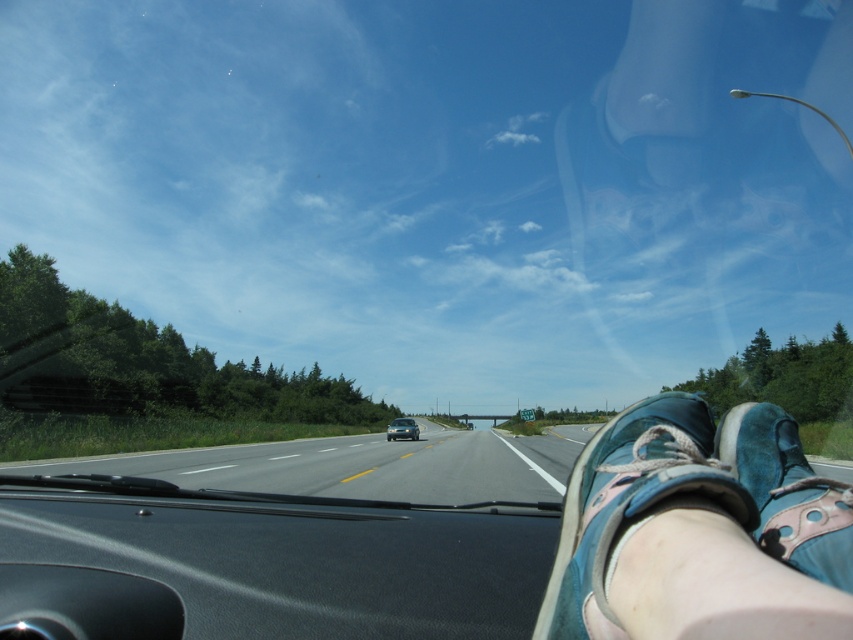
In the scene shown: Who is higher up, suede blue shoe at lower right or metallic silver sedan at center?

Positioned higher is suede blue shoe at lower right.

Is suede blue shoe at lower right bigger than metallic silver sedan at center?

No.

Describe the element at coordinates (788, 492) in the screenshot. This screenshot has width=853, height=640. I see `suede blue shoe at lower right` at that location.

Locate an element on the screen. The width and height of the screenshot is (853, 640). suede blue shoe at lower right is located at coordinates (788, 492).

Can you confirm if blue suede shoe at lower right is smaller than metallic silver sedan at center?

Yes.

The image size is (853, 640). What are the coordinates of `blue suede shoe at lower right` in the screenshot? It's located at (631, 500).

Is blue suede shoe at lower right taller than suede blue shoe at lower right?

Incorrect, blue suede shoe at lower right's height is not larger of suede blue shoe at lower right's.

Who is more forward, (578, 580) or (782, 512)?

Point (578, 580) is more forward.

Which is behind, point (724, 476) or point (770, 552)?

The point (770, 552) is more distant.

Identify the location of blue suede shoe at lower right. (631, 500).